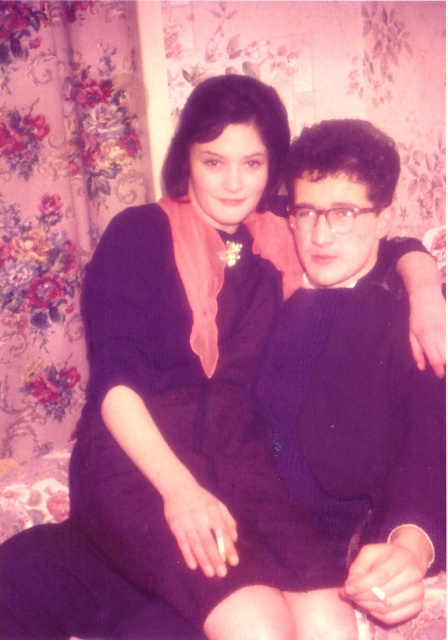
Question: Is matte purple dress at center further to the viewer compared to purple knitted sweater at center?

Choices:
 (A) yes
 (B) no

Answer: (A)

Question: Which of the following is the closest to the observer?

Choices:
 (A) matte purple dress at center
 (B) purple knitted sweater at center

Answer: (B)

Question: Where is matte purple dress at center located in relation to purple knitted sweater at center in the image?

Choices:
 (A) above
 (B) below

Answer: (B)

Question: Among these objects, which one is farthest from the camera?

Choices:
 (A) purple knitted sweater at center
 (B) matte purple dress at center

Answer: (B)

Question: Is matte purple dress at center to the right of purple knitted sweater at center from the viewer's perspective?

Choices:
 (A) no
 (B) yes

Answer: (A)